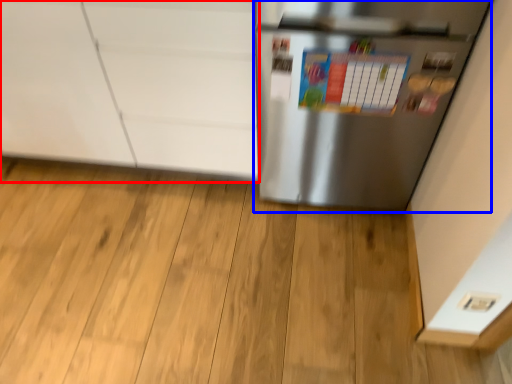
Question: Among these objects, which one is nearest to the camera, cabinetry (highlighted by a red box) or refrigerator (highlighted by a blue box)?

Choices:
 (A) cabinetry
 (B) refrigerator

Answer: (B)